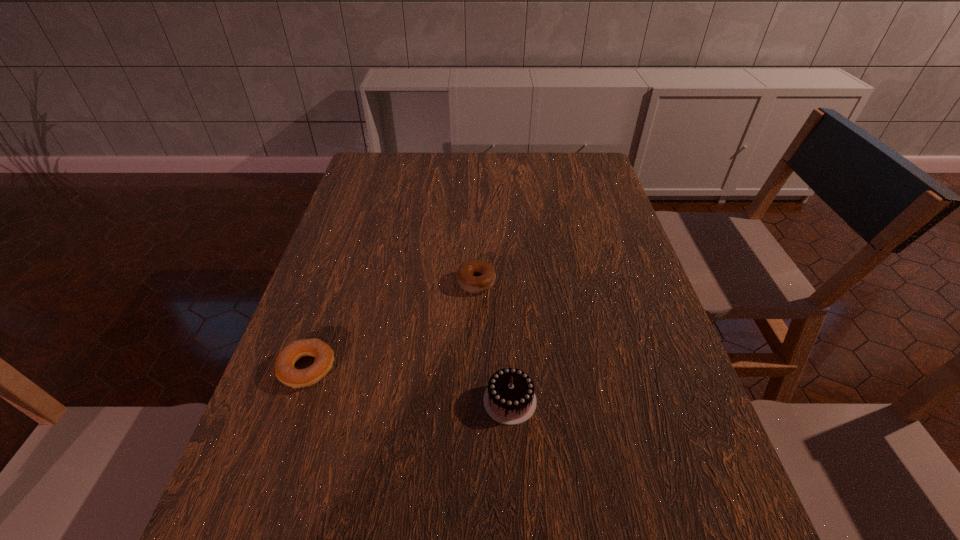
This screenshot has height=540, width=960. Identify the location of vacant space in between the chocolate cake and the right bagel. (493, 342).

At what (x,y) coordinates should I click in order to perform the action: click on vacant space that is in between the chocolate cake and the left bagel. Please return your answer as a coordinate pair (x, y). The image size is (960, 540). Looking at the image, I should click on (408, 384).

Identify the location of free spot between the right bagel and the leftmost object. point(392,325).

The height and width of the screenshot is (540, 960). I want to click on object that is the second nearest to the chocolate cake, so click(x=285, y=371).

Select which object is the closest to the tallest object. Please provide its 2D coordinates. Your answer should be formatted as a tuple, i.e. [(x, y)], where the tuple contains the x and y coordinates of a point satisfying the conditions above.

[(474, 276)]

Where is `vacant region that satisfies the following two spatial constraints: 1. on the front side of the farthest object; 2. on the right side of the tallest object`? The image size is (960, 540). vacant region that satisfies the following two spatial constraints: 1. on the front side of the farthest object; 2. on the right side of the tallest object is located at coordinates (476, 401).

At what (x,y) coordinates should I click in order to perform the action: click on free point that satisfies the following two spatial constraints: 1. on the back side of the nearer bagel; 2. on the right side of the right bagel. Please return your answer as a coordinate pair (x, y). Looking at the image, I should click on (336, 282).

Find the location of a particular element. The image size is (960, 540). free point that satisfies the following two spatial constraints: 1. on the back side of the leftmost object; 2. on the right side of the farthest object is located at coordinates (336, 282).

Locate an element on the screen. free space that satisfies the following two spatial constraints: 1. on the front side of the tallest object; 2. on the left side of the left bagel is located at coordinates (296, 401).

Find the location of `free point that satisfies the following two spatial constraints: 1. on the front side of the nearer bagel; 2. on the right side of the chocolate cake`. free point that satisfies the following two spatial constraints: 1. on the front side of the nearer bagel; 2. on the right side of the chocolate cake is located at coordinates (296, 401).